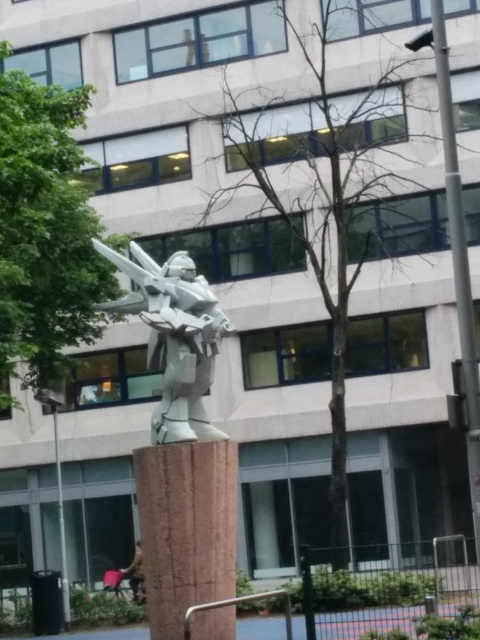
Question: Is metallic pole at left bigger than metallic pole at center?

Choices:
 (A) yes
 (B) no

Answer: (A)

Question: In this image, where is white glossy statue at center located relative to brown fabric bag at lower center?

Choices:
 (A) right
 (B) left

Answer: (A)

Question: Does white matte sculpture at center have a greater width compared to white glossy statue at center?

Choices:
 (A) yes
 (B) no

Answer: (A)

Question: Considering the real-world distances, which object is farthest from the brown stone post at center?

Choices:
 (A) brown fabric bag at lower center
 (B) metallic pole at left
 (C) metallic pole at center
 (D) white matte sculpture at center

Answer: (A)

Question: Which of the following is the closest to the observer?

Choices:
 (A) bare branches at center
 (B) white matte sculpture at center

Answer: (B)

Question: Which object appears farthest from the camera in this image?

Choices:
 (A) white matte sculpture at center
 (B) brown fabric bag at lower center
 (C) brown stone post at center
 (D) metallic pole at center

Answer: (B)